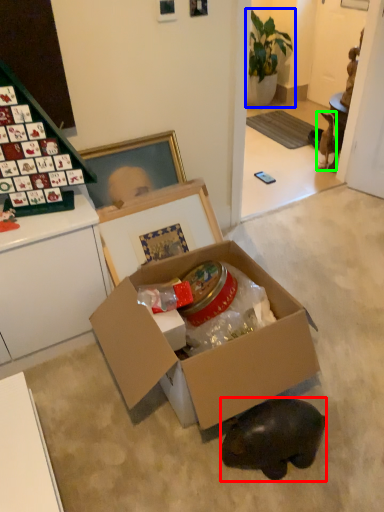
Question: Which object is the farthest from animal (highlighted by a red box)? Choose among these: houseplant (highlighted by a blue box) or animal (highlighted by a green box).

Choices:
 (A) houseplant
 (B) animal

Answer: (A)